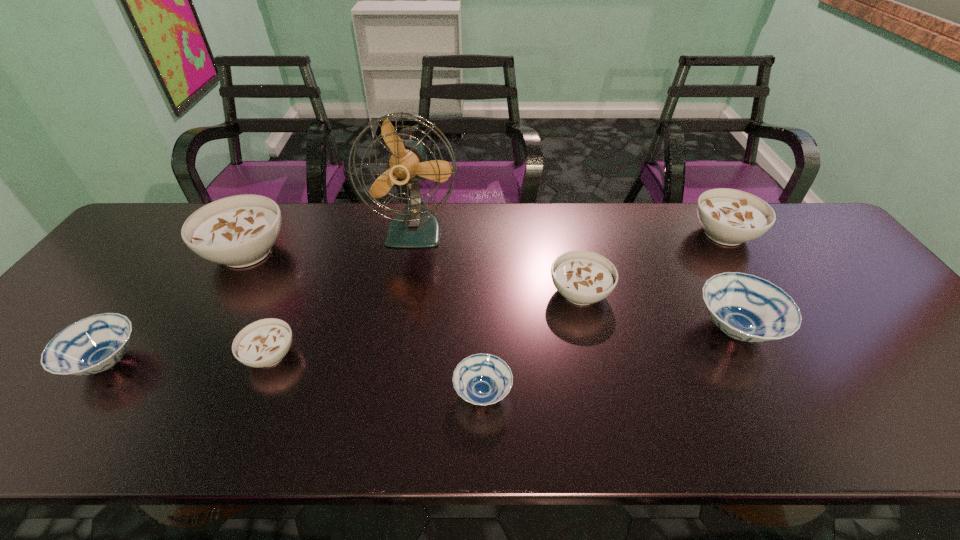
I want to click on fan, so click(416, 227).

Find the location of a particular element. This screenshot has width=960, height=540. the tallest object is located at coordinates [416, 227].

This screenshot has width=960, height=540. Identify the location of the tallest soup bowl. (238, 231).

I want to click on the biggest white soup bowl, so click(x=238, y=231).

The height and width of the screenshot is (540, 960). What are the coordinates of `the second biggest white soup bowl` in the screenshot? It's located at (730, 217).

The height and width of the screenshot is (540, 960). Find the location of `the biggest blue soup bowl`. the biggest blue soup bowl is located at coordinates (745, 307).

Where is `the third soup bowl from right to left`? This screenshot has width=960, height=540. the third soup bowl from right to left is located at coordinates (583, 277).

This screenshot has width=960, height=540. In order to click on the third white soup bowl from left to right in this screenshot , I will do `click(583, 277)`.

I want to click on the leftmost blue soup bowl, so click(94, 344).

At what (x,y) coordinates should I click in order to perform the action: click on the nearest white soup bowl. Please return your answer as a coordinate pair (x, y). Looking at the image, I should click on (263, 343).